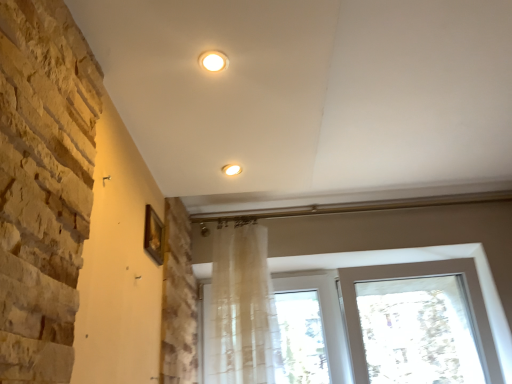
Measure the distance between transparent fabric at bottom and camera.

6.16 feet.

The height and width of the screenshot is (384, 512). I want to click on natural stone wall at left, so click(42, 184).

What is the approximate height of natural stone wall at left?

natural stone wall at left is 34.04 inches tall.

What do you see at coordinates (213, 61) in the screenshot?
I see `matte white light fixture at upper center, arranged as the second lighting when ordered from the bottom` at bounding box center [213, 61].

Find the location of a particular element. translucent fabric shower curtain at center is located at coordinates (243, 307).

Is transparent fabric at bottom looking in the opposite direction of matte white light fixture at center, marked as the 2th lighting in a top-to-bottom arrangement?

transparent fabric at bottom is not turned away from matte white light fixture at center, marked as the 2th lighting in a top-to-bottom arrangement.

From the picture: Would you say transparent fabric at bottom contains matte white light fixture at center, which is counted as the 1th lighting, starting from the bottom?

Definitely not — matte white light fixture at center, which is counted as the 1th lighting, starting from the bottom, is not inside transparent fabric at bottom.

Does point (400, 257) come closer to viewer compared to point (232, 173)?

No, it is not.

Is natural stone wall at left spatially inside translucent fabric shower curtain at center, or outside of it?

natural stone wall at left lies outside translucent fabric shower curtain at center.

Considering the sizes of objects natural stone wall at left and translucent fabric shower curtain at center in the image provided, who is taller, natural stone wall at left or translucent fabric shower curtain at center?

natural stone wall at left is taller.

Which object is positioned more to the right, natural stone wall at left or translucent fabric shower curtain at center?

Positioned to the right is translucent fabric shower curtain at center.

Where is `shower curtain below the natural stone wall at left (from the image's perspective)`? Image resolution: width=512 pixels, height=384 pixels. shower curtain below the natural stone wall at left (from the image's perspective) is located at coordinates (243, 307).

Consider the image. Is translucent fabric shower curtain at center outside of natural stone wall at left?

Indeed, translucent fabric shower curtain at center is completely outside natural stone wall at left.

Who is taller, translucent fabric shower curtain at center or natural stone wall at left?

With more height is natural stone wall at left.

Looking at their sizes, would you say translucent fabric shower curtain at center is wider or thinner than natural stone wall at left?

translucent fabric shower curtain at center is wider than natural stone wall at left.

From the image's perspective, is translucent fabric shower curtain at center positioned above or below natural stone wall at left?

Based on their image positions, translucent fabric shower curtain at center is located beneath natural stone wall at left.

Considering the relative sizes of matte white light fixture at center, marked as the 2th lighting in a top-to-bottom arrangement, and matte white light fixture at upper center, arranged as the second lighting when ordered from the bottom, in the image provided, is matte white light fixture at center, marked as the 2th lighting in a top-to-bottom arrangement, shorter than matte white light fixture at upper center, arranged as the second lighting when ordered from the bottom,?

Incorrect, the height of matte white light fixture at center, marked as the 2th lighting in a top-to-bottom arrangement, does not fall short of that of matte white light fixture at upper center, arranged as the second lighting when ordered from the bottom.

Is point (228, 164) in front of point (215, 71)?

No, it is not.

From a real-world perspective, who is located higher, matte white light fixture at center, which is counted as the 1th lighting, starting from the bottom, or matte white light fixture at upper center, arranged as the second lighting when ordered from the bottom?

From a 3D spatial view, matte white light fixture at center, which is counted as the 1th lighting, starting from the bottom, is above.

In terms of width, does matte white light fixture at center, positioned as the 1th lighting in back-to-front order, look wider or thinner when compared to matte white light fixture at upper center, marked as the first lighting in a top-to-bottom arrangement?

Clearly, matte white light fixture at center, positioned as the 1th lighting in back-to-front order, has less width compared to matte white light fixture at upper center, marked as the first lighting in a top-to-bottom arrangement.

Is wooden picture frame at upper left beside transparent fabric at bottom?

No.

Would you say wooden picture frame at upper left is to the left or to the right of transparent fabric at bottom in the picture?

Based on their positions, wooden picture frame at upper left is located to the left of transparent fabric at bottom.

From a real-world perspective, is wooden picture frame at upper left physically located above or below transparent fabric at bottom?

From a real-world perspective, wooden picture frame at upper left is physically above transparent fabric at bottom.

From the image's perspective, does natural stone wall at left appear lower than wooden picture frame at upper left?

Yes.

Would you consider natural stone wall at left to be distant from wooden picture frame at upper left?

natural stone wall at left is actually quite close to wooden picture frame at upper left.

Which object is closer to the camera, natural stone wall at left or wooden picture frame at upper left?

natural stone wall at left.

Between natural stone wall at left and wooden picture frame at upper left, which one has smaller width?

Thinner between the two is wooden picture frame at upper left.

From the picture: Is matte white light fixture at center, arranged as the 2th lighting when viewed from the front, facing towards translucent fabric shower curtain at center?

No, matte white light fixture at center, arranged as the 2th lighting when viewed from the front, is not oriented towards translucent fabric shower curtain at center.

The image size is (512, 384). In the image, there is a matte white light fixture at center, positioned as the 1th lighting in back-to-front order. Identify the location of shower curtain below it (from a real-world perspective). coord(243,307).

Which of these two, matte white light fixture at center, arranged as the 2th lighting when viewed from the front, or translucent fabric shower curtain at center, is bigger?

translucent fabric shower curtain at center.

Identify the location of window that appears on the right of matte white light fixture at center, which is counted as the 1th lighting, starting from the bottom. coord(413,262).

In order to click on shower curtain behind the natural stone wall at left in this screenshot , I will do `click(243, 307)`.

Looking at the image, which one is located closer to matte white light fixture at center, marked as the 2th lighting in a top-to-bottom arrangement, transparent fabric at bottom or wooden picture frame at upper left?

Based on the image, wooden picture frame at upper left appears to be nearer to matte white light fixture at center, marked as the 2th lighting in a top-to-bottom arrangement.

Looking at the image, which one is located further to matte white light fixture at upper center, marked as the first lighting in a top-to-bottom arrangement, transparent fabric at bottom or translucent fabric shower curtain at center?

transparent fabric at bottom is further to matte white light fixture at upper center, marked as the first lighting in a top-to-bottom arrangement.

Looking at the image, which one is located closer to wooden picture frame at upper left, transparent fabric at bottom or matte white light fixture at center, marked as the 2th lighting in a top-to-bottom arrangement?

matte white light fixture at center, marked as the 2th lighting in a top-to-bottom arrangement.

Which object lies nearer to the anchor point wooden picture frame at upper left, translucent fabric shower curtain at center or matte white light fixture at upper center, which appears as the first lighting when viewed from the front?

translucent fabric shower curtain at center is closer to wooden picture frame at upper left.

Based on their spatial positions, is natural stone wall at left or transparent fabric at bottom further from wooden picture frame at upper left?

Based on the image, transparent fabric at bottom appears to be further to wooden picture frame at upper left.

Estimate the real-world distances between objects in this image. Which object is closer to transparent fabric at bottom, wooden picture frame at upper left or matte white light fixture at center, arranged as the 2th lighting when viewed from the front?

Based on the image, wooden picture frame at upper left appears to be nearer to transparent fabric at bottom.

From the image, which object appears to be farther from matte white light fixture at upper center, marked as the first lighting in a top-to-bottom arrangement, matte white light fixture at center, which is counted as the 1th lighting, starting from the bottom, or translucent fabric shower curtain at center?

translucent fabric shower curtain at center is positioned further to the anchor matte white light fixture at upper center, marked as the first lighting in a top-to-bottom arrangement.

From the picture: Based on their spatial positions, is wooden picture frame at upper left or matte white light fixture at center, marked as the 2th lighting in a top-to-bottom arrangement, further from natural stone wall at left?

matte white light fixture at center, marked as the 2th lighting in a top-to-bottom arrangement, is further to natural stone wall at left.

Locate an element on the screen. The height and width of the screenshot is (384, 512). lighting positioned between natural stone wall at left and wooden picture frame at upper left from near to far is located at coordinates (213, 61).

This screenshot has height=384, width=512. In order to click on picture frame between natural stone wall at left and matte white light fixture at center, which is counted as the 1th lighting, starting from the bottom, from front to back in this screenshot , I will do `click(154, 235)`.

Identify the location of picture frame between natural stone wall at left and translucent fabric shower curtain at center in the front-back direction. (154, 235).

Where is `lighting between matte white light fixture at upper center, which appears as the first lighting when viewed from the front, and transparent fabric at bottom vertically`? The height and width of the screenshot is (384, 512). lighting between matte white light fixture at upper center, which appears as the first lighting when viewed from the front, and transparent fabric at bottom vertically is located at coordinates (231, 169).